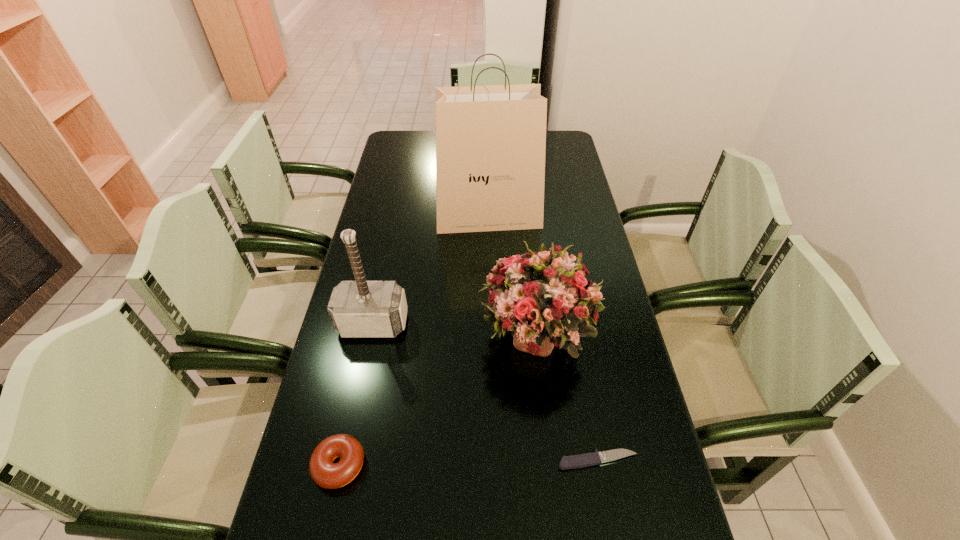
The width and height of the screenshot is (960, 540). What are the coordinates of `unoccupied position between the bouquet and the doughnut` in the screenshot? It's located at (438, 400).

Where is `vacant space in between the third shortest object and the doughnut`? The height and width of the screenshot is (540, 960). vacant space in between the third shortest object and the doughnut is located at coordinates (438, 400).

Find the location of a particular element. vacant region between the tallest object and the hammer is located at coordinates (431, 270).

Find the location of a particular element. The height and width of the screenshot is (540, 960). free area in between the second shortest object and the hammer is located at coordinates (356, 394).

Identify which object is the nearest to the third shortest object. Please provide its 2D coordinates. Your answer should be formatted as a tuple, i.e. [(x, y)], where the tuple contains the x and y coordinates of a point satisfying the conditions above.

[(588, 459)]

Locate which object ranks in proximity to the second tallest object. Please provide its 2D coordinates. Your answer should be formatted as a tuple, i.e. [(x, y)], where the tuple contains the x and y coordinates of a point satisfying the conditions above.

[(543, 298)]

Identify the location of free space that satisfies the following two spatial constraints: 1. for striking with the head of the fourth shortest object; 2. on the left side of the bouquet. The width and height of the screenshot is (960, 540). (371, 335).

I want to click on free location that satisfies the following two spatial constraints: 1. for striking with the head of the bouquet; 2. on the left side of the second tallest object, so click(371, 335).

I want to click on blank area in the image that satisfies the following two spatial constraints: 1. on the front side of the steak knife; 2. on the right side of the farthest object, so click(x=493, y=460).

Locate an element on the screen. The image size is (960, 540). free space that satisfies the following two spatial constraints: 1. on the back side of the doughnut; 2. on the left side of the bouquet is located at coordinates (368, 335).